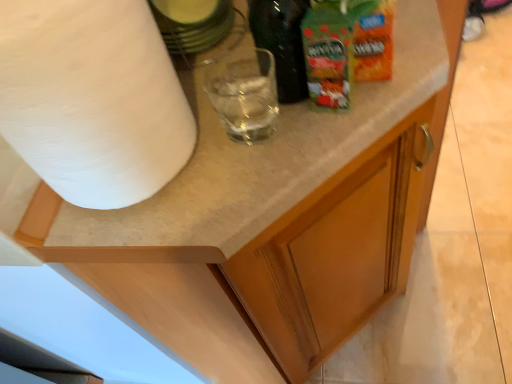
You are a GUI agent. You are given a task and a screenshot of the screen. Output one action in this format:
    pyautogui.click(x=<x>, y=<y>)
    Task: Click on the white matte paper towel at upper left
    The image size is (512, 384).
    Given the screenshot: What is the action you would take?
    pyautogui.click(x=92, y=99)

What do you see at coordinates (92, 99) in the screenshot? The height and width of the screenshot is (384, 512). I see `white matte paper towel at upper left` at bounding box center [92, 99].

Locate an element on the screen. white matte paper towel at upper left is located at coordinates (92, 99).